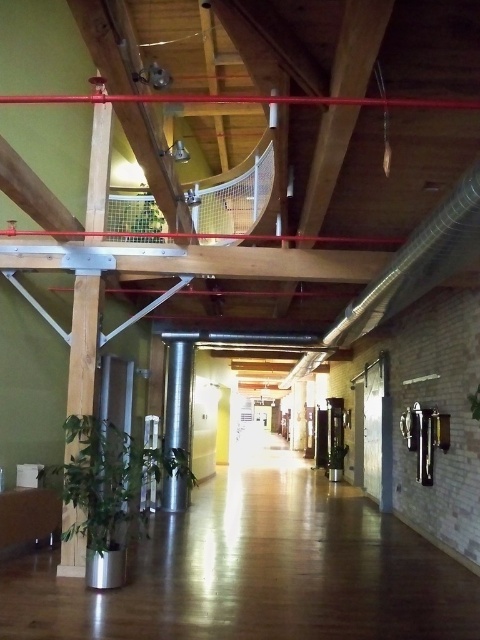
Is metallic red railing at upper center smaller than silver metallic pillar at center?

Yes, metallic red railing at upper center is smaller than silver metallic pillar at center.

Does point (368, 97) come closer to viewer compared to point (179, 499)?

Yes, it is.

Does point (305, 97) lie behind point (181, 349)?

No, it is not.

Image resolution: width=480 pixels, height=640 pixels. What are the coordinates of `metallic red railing at upper center` in the screenshot? It's located at (242, 99).

Can you confirm if green leafy plant at lower left is positioned to the left of green leafy plant at upper center?

No, green leafy plant at lower left is not to the left of green leafy plant at upper center.

Is green leafy plant at lower left taller than green leafy plant at upper center?

Yes, green leafy plant at lower left is taller than green leafy plant at upper center.

The height and width of the screenshot is (640, 480). Identify the location of green leafy plant at lower left. (110, 480).

Which is more to the left, metallic red railing at upper center or green leafy plant at upper center?

green leafy plant at upper center is more to the left.

Does point (240, 97) lie in front of point (148, 208)?

No, (240, 97) is behind (148, 208).

I want to click on metallic red railing at upper center, so click(x=242, y=99).

This screenshot has height=640, width=480. I want to click on metallic red railing at upper center, so click(242, 99).